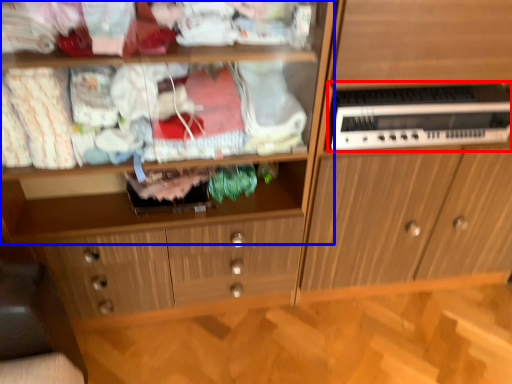
Question: Among these objects, which one is nearest to the camera, home appliance (highlighted by a red box) or shelf (highlighted by a blue box)?

Choices:
 (A) home appliance
 (B) shelf

Answer: (B)